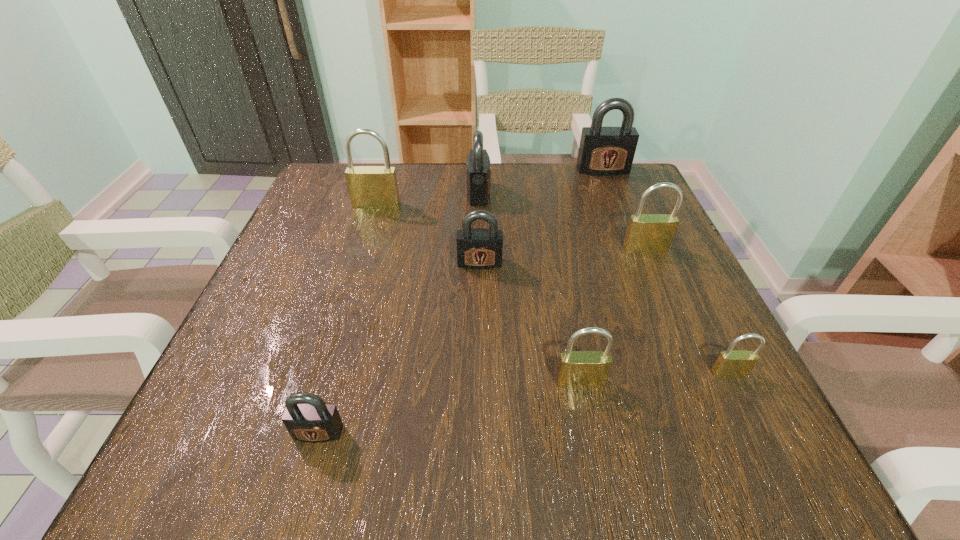
Identify the location of object positioned at the near edge. (307, 417).

Locate an element on the screen. object situated at the far left corner is located at coordinates (370, 187).

Locate an element on the screen. This screenshot has height=540, width=960. object that is at the near left corner is located at coordinates (307, 417).

You are a GUI agent. You are given a task and a screenshot of the screen. Output one action in this format:
    pyautogui.click(x=<x>, y=<y>)
    Task: Click on the object that is at the far right corner
    
    Given the screenshot: What is the action you would take?
    pyautogui.click(x=604, y=151)

The width and height of the screenshot is (960, 540). Find the location of `free space at the far edge`. free space at the far edge is located at coordinates (525, 208).

Identify the location of vacant space at the left edge of the desktop. The height and width of the screenshot is (540, 960). (257, 319).

Identify the location of vacant space at the right edge of the desktop. (699, 392).

In the image, there is a desktop. Where is `free space at the far left corner`? This screenshot has height=540, width=960. free space at the far left corner is located at coordinates (324, 216).

At what (x,y) coordinates should I click in order to perform the action: click on blank area at the far right corner. Please return your answer as a coordinate pair (x, y). Looking at the image, I should click on (651, 197).

At what (x,y) coordinates should I click in order to perform the action: click on vacant region at the near right corner of the desktop. Please return your answer as a coordinate pair (x, y). The image size is (960, 540). Looking at the image, I should click on (722, 474).